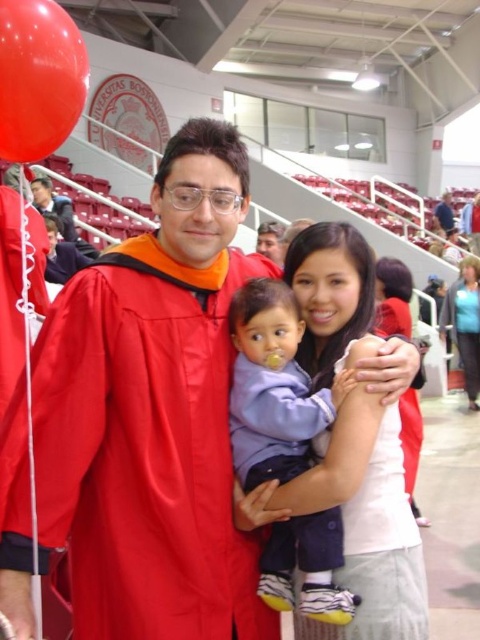
Question: Which object is the farthest from the blue fabric shirt at upper right?

Choices:
 (A) matte red graduation gown at center
 (B) white matte dress at center
 (C) light blue fabric baby at center
 (D) white fabric shirt at upper center

Answer: (C)

Question: Does matte red gown at center lie in front of matte black graduation gown at center?

Choices:
 (A) yes
 (B) no

Answer: (A)

Question: Can you confirm if matte black graduation gown at center is thinner than blue fabric shirt at upper right?

Choices:
 (A) no
 (B) yes

Answer: (B)

Question: Can you confirm if rubber balloon at upper left is positioned above blue fabric shirt at upper right?

Choices:
 (A) no
 (B) yes

Answer: (A)

Question: Considering the real-world distances, which object is closest to the white fabric shirt at upper center?

Choices:
 (A) blue fabric shirt at upper right
 (B) matte red graduation gown at center

Answer: (B)

Question: Which object is positioned closest to the white fabric shirt at upper center?

Choices:
 (A) white matte dress at center
 (B) matte black graduation gown at center

Answer: (A)